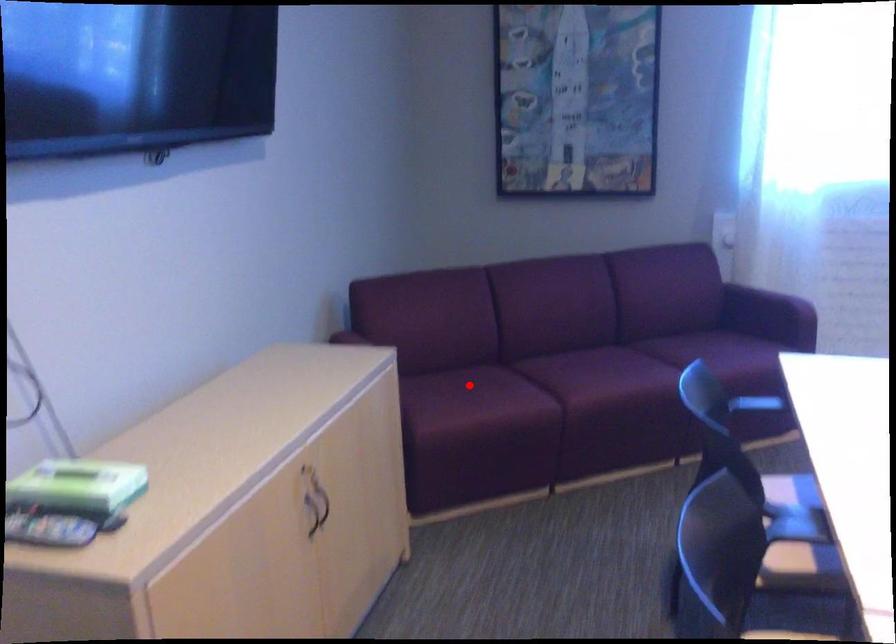
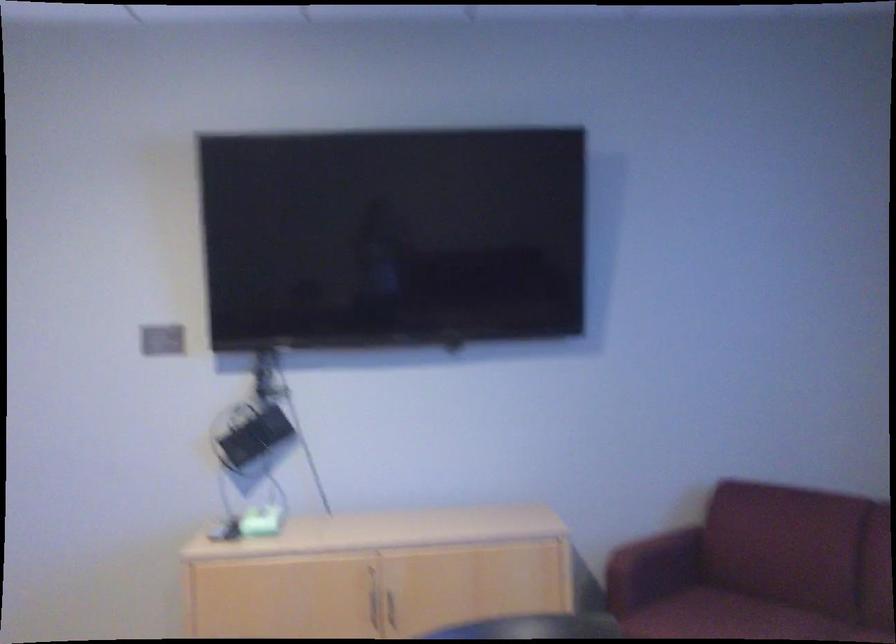
Question: I am providing you with two images of the same scene from different viewpoints. A red point is marked on the first image. Is the red point's position out of view in image 2?

Choices:
 (A) Yes
 (B) No

Answer: (B)